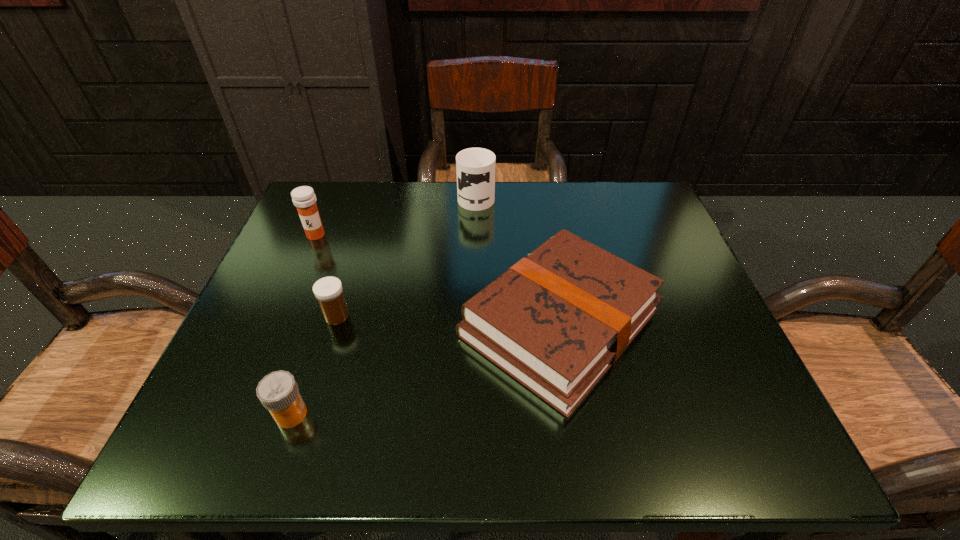
Where is `the farthest object`? The height and width of the screenshot is (540, 960). the farthest object is located at coordinates (475, 167).

The height and width of the screenshot is (540, 960). Find the location of `the farthest medicine`. the farthest medicine is located at coordinates (303, 197).

This screenshot has width=960, height=540. Find the location of `the fourth nearest object`. the fourth nearest object is located at coordinates (303, 197).

The height and width of the screenshot is (540, 960). I want to click on hardback book, so click(x=556, y=321).

In order to click on the nearest medicine in this screenshot , I will do `click(278, 392)`.

You are a GUI agent. You are given a task and a screenshot of the screen. Output one action in this format:
    pyautogui.click(x=<x>, y=<y>)
    Task: Click on the second nearest medicine
    The height and width of the screenshot is (540, 960).
    Given the screenshot: What is the action you would take?
    pyautogui.click(x=328, y=291)

Identify the location of vacant point located on the label side of the farthest medicine. This screenshot has height=540, width=960. (299, 275).

Find the location of a particular element. The height and width of the screenshot is (540, 960). vacant space located on the back of the hardback book is located at coordinates 546,240.

Find the location of a particular element. This screenshot has width=960, height=540. blank space located on the label side of the nearest medicine is located at coordinates (453, 414).

Locate an element on the screen. The height and width of the screenshot is (540, 960). vacant space positioned 0.180m on the front of the second farthest medicine is located at coordinates (306, 413).